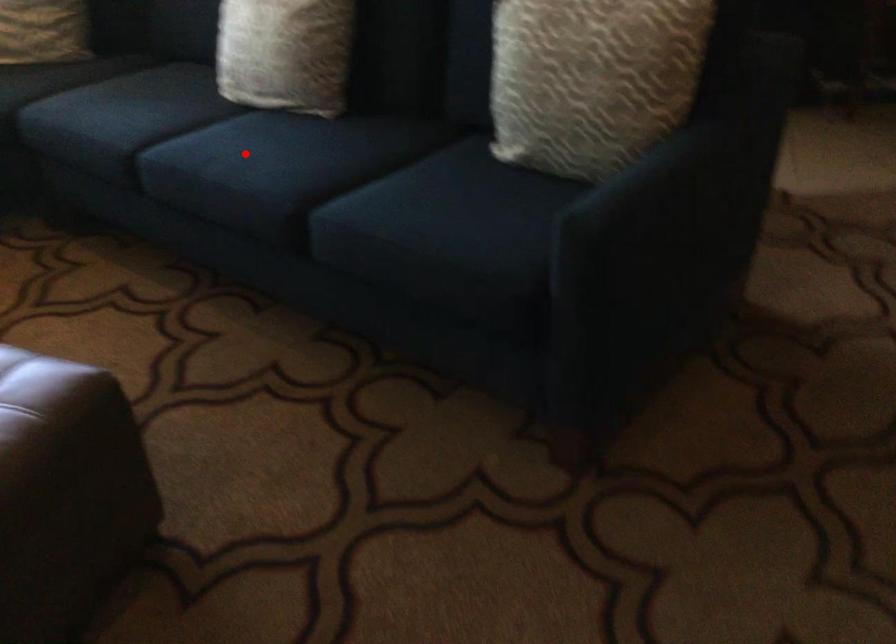
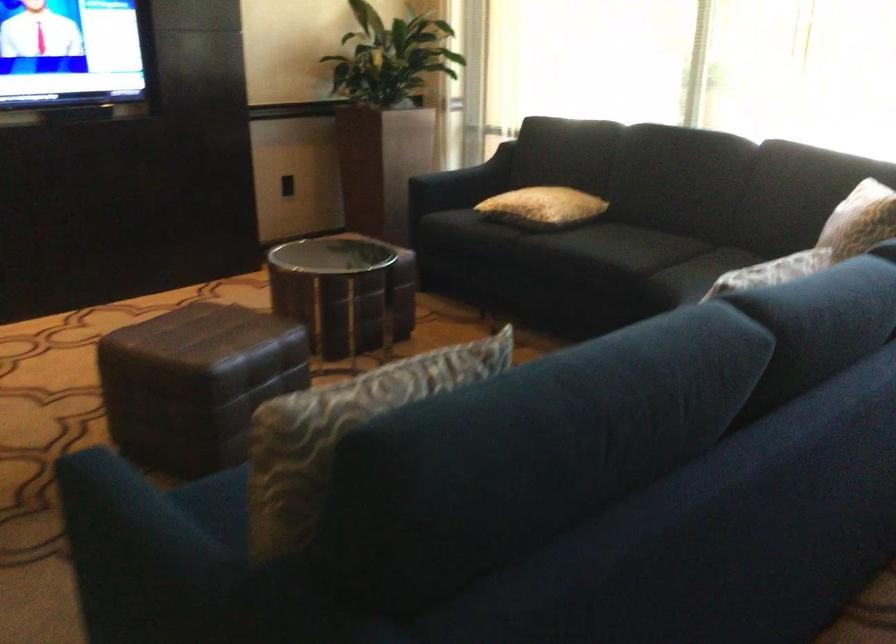
Question: I am providing you with two images of the same scene from different viewpoints. A red point is marked on the first image. At the location where the point appears in image 1, is it still visible in image 2?

Choices:
 (A) Yes
 (B) No

Answer: (B)